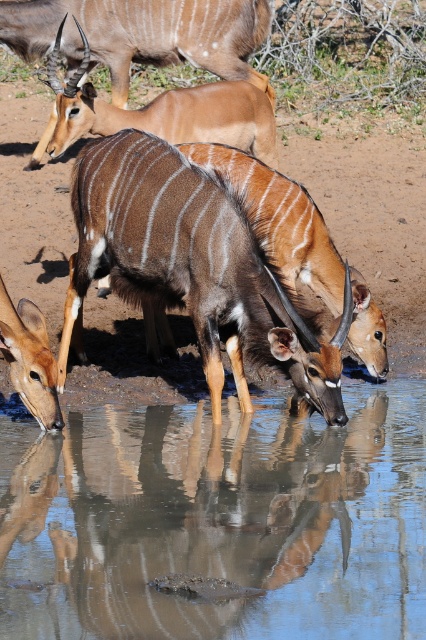
Question: In this image, where is brown glossy antelope at center located relative to brown glossy antelope at lower left?

Choices:
 (A) right
 (B) left

Answer: (A)

Question: Which object is closer to the camera taking this photo?

Choices:
 (A) brown glossy antelope at center
 (B) clear liquid water at center

Answer: (B)

Question: From the image, what is the correct spatial relationship of clear liquid water at center in relation to brown glossy antelope at upper center?

Choices:
 (A) above
 (B) below

Answer: (B)

Question: Can you confirm if brown glossy antelope at center is positioned above brown glossy antelope at upper center?

Choices:
 (A) yes
 (B) no

Answer: (B)

Question: Which of these objects is positioned farthest from the clear liquid water at center?

Choices:
 (A) brown glossy antelope at lower left
 (B) brown glossy antelope at upper center

Answer: (B)

Question: Which is farther from the brown glossy antelope at upper center?

Choices:
 (A) brown glossy antelope at center
 (B) brown glossy antelope at lower left
 (C) clear liquid water at center

Answer: (C)